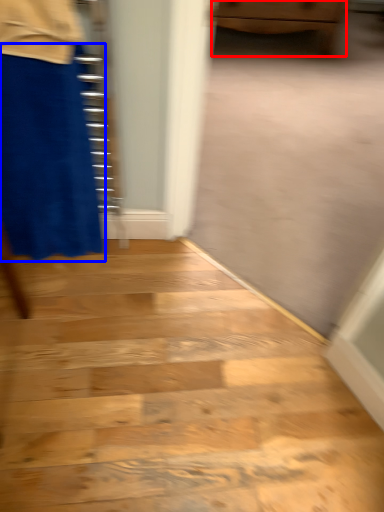
Question: Which of the following is the farthest to the observer, furniture (highlighted by a red box) or miniskirt (highlighted by a blue box)?

Choices:
 (A) furniture
 (B) miniskirt

Answer: (A)